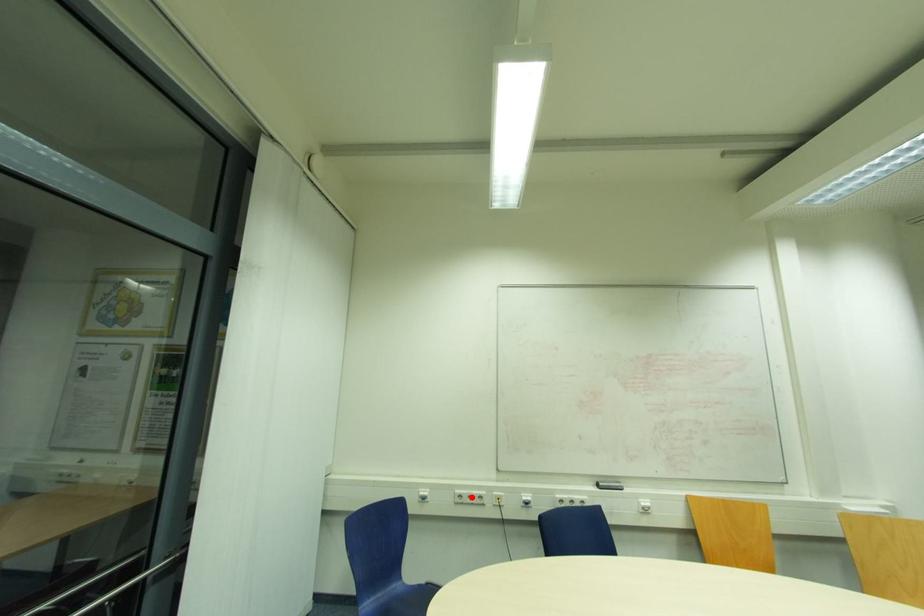
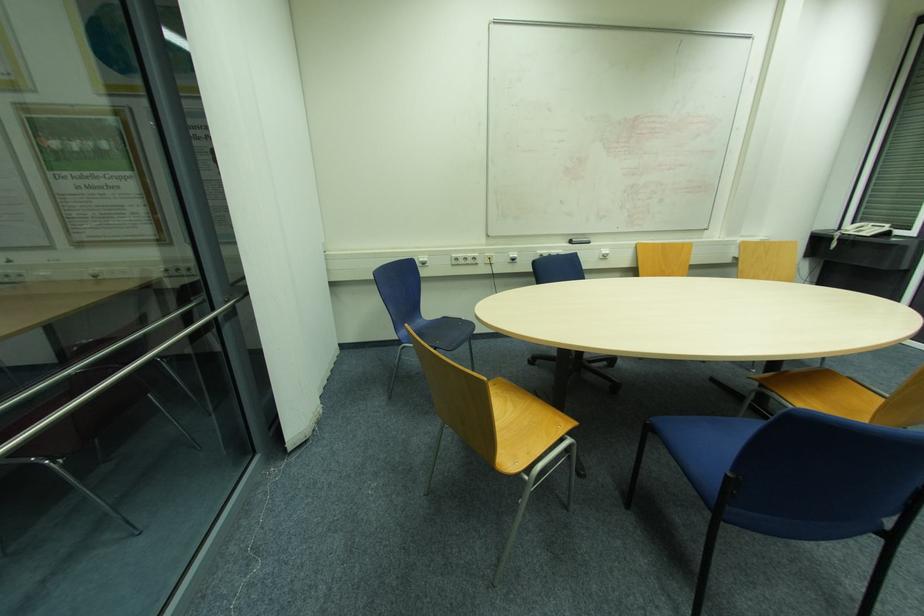
Find the pixel in the second image that matches the highlighted location in the first image.

(467, 259)